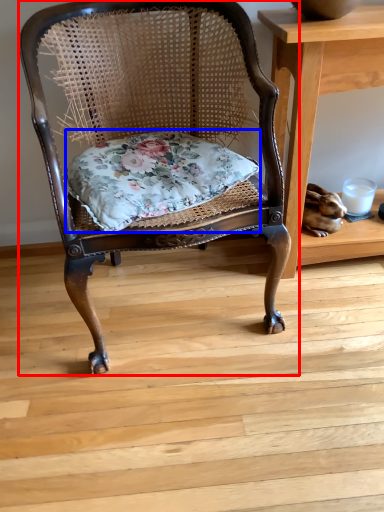
Question: Which point is closer to the camera, chair (highlighted by a red box) or pillow (highlighted by a blue box)?

Choices:
 (A) chair
 (B) pillow

Answer: (A)